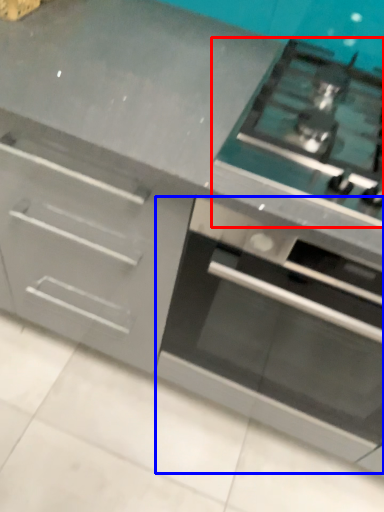
Question: Which of the following is the closest to the observer, gas stove (highlighted by a red box) or oven (highlighted by a blue box)?

Choices:
 (A) gas stove
 (B) oven

Answer: (B)